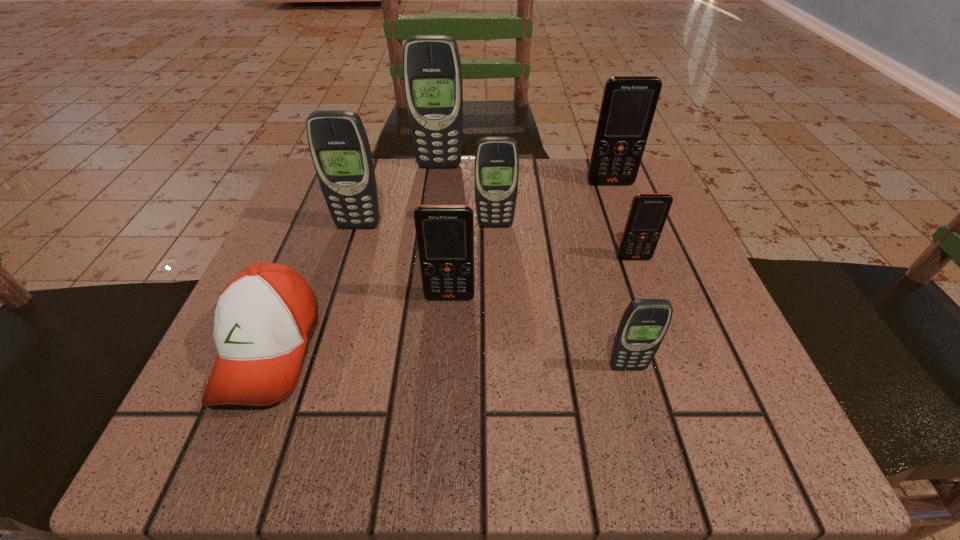
Find the location of `free space located 0.200m on the screen of the fourth nearest object`. free space located 0.200m on the screen of the fourth nearest object is located at coordinates (670, 356).

Locate an element on the screen. vacant space situated 0.100m on the screen of the smallest gray cellular telephone is located at coordinates (648, 441).

This screenshot has height=540, width=960. I want to click on object positioned at the near edge, so tap(263, 317).

Where is `cellular telephone that is at the left edge`? cellular telephone that is at the left edge is located at coordinates (339, 146).

Identify the location of baseball cap that is at the left edge. Image resolution: width=960 pixels, height=540 pixels. (263, 317).

In order to click on object that is at the far left corner in this screenshot , I will do `click(339, 146)`.

The height and width of the screenshot is (540, 960). I want to click on object located in the near left corner section of the desktop, so click(x=263, y=317).

Where is `object that is at the far right corner`? Image resolution: width=960 pixels, height=540 pixels. object that is at the far right corner is located at coordinates (628, 106).

Image resolution: width=960 pixels, height=540 pixels. What are the coordinates of `free space at the far edge of the desktop` in the screenshot? It's located at (570, 224).

Where is `vacant region at the near edge of the desktop`? The width and height of the screenshot is (960, 540). vacant region at the near edge of the desktop is located at coordinates (504, 424).